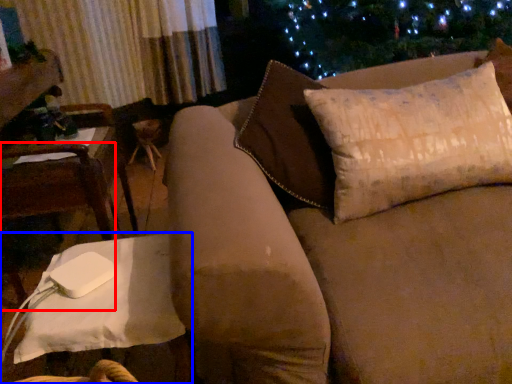
Question: Which object appears closest to the camera in this image, chair (highlighted by a red box) or table (highlighted by a blue box)?

Choices:
 (A) chair
 (B) table

Answer: (B)